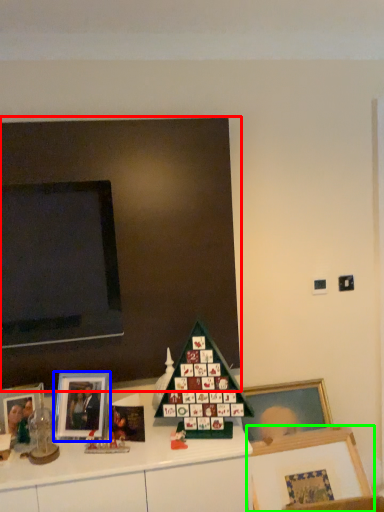
Question: Which object is positioned farthest from bulletin board (highlighted by a red box)? Select from picture frame (highlighted by a blue box) and picture frame (highlighted by a green box).

Choices:
 (A) picture frame
 (B) picture frame

Answer: (B)